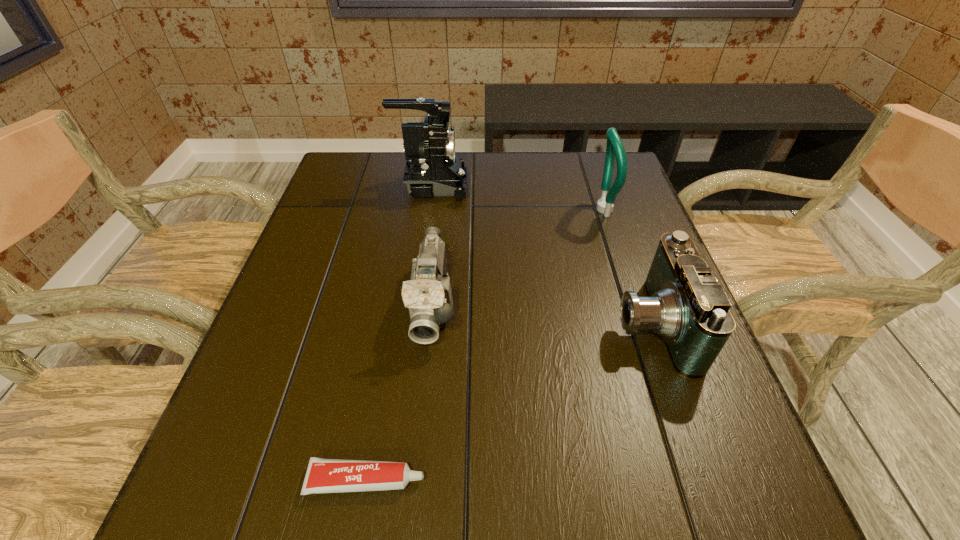
Identify the location of vacant space situated 0.180m on the front-facing side of the rightmost camcorder. (524, 324).

At what (x,y) coordinates should I click in order to perform the action: click on vacant space situated on the front-facing side of the rightmost camcorder. Please return your answer as a coordinate pair (x, y). Looking at the image, I should click on (505, 324).

In order to click on vacant position located 0.150m at the nozzle of the nearest object in this screenshot , I will do `click(522, 480)`.

Where is `camcorder that is at the far edge`? Image resolution: width=960 pixels, height=540 pixels. camcorder that is at the far edge is located at coordinates (433, 168).

The image size is (960, 540). Identify the location of bottle opener located at the far edge. (614, 149).

You are a GUI agent. You are given a task and a screenshot of the screen. Output one action in this format:
    pyautogui.click(x=<x>, y=<y>)
    Task: Click on the object positioned at the near edge
    
    Given the screenshot: What is the action you would take?
    pyautogui.click(x=323, y=475)

Locate an element on the screen. The height and width of the screenshot is (540, 960). bottle opener at the right edge is located at coordinates (614, 149).

In order to click on camcorder located at the right edge in this screenshot , I will do `click(685, 304)`.

Image resolution: width=960 pixels, height=540 pixels. I want to click on object that is at the far right corner, so click(614, 149).

Image resolution: width=960 pixels, height=540 pixels. Find the location of `free space at the far edge`. free space at the far edge is located at coordinates (540, 185).